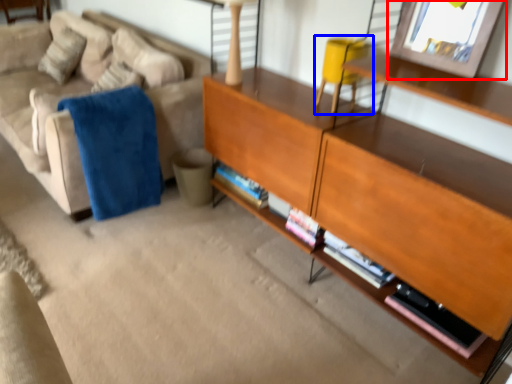
Question: Among these objects, which one is farthest to the camera, picture frame (highlighted by a red box) or swivel chair (highlighted by a blue box)?

Choices:
 (A) picture frame
 (B) swivel chair

Answer: (B)